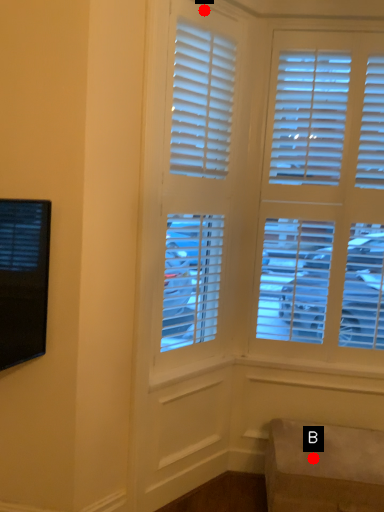
Question: Two points are circled on the image, labeled by A and B beside each circle. Which point appears closest to the camera in this image?

Choices:
 (A) A is closer
 (B) B is closer

Answer: (B)